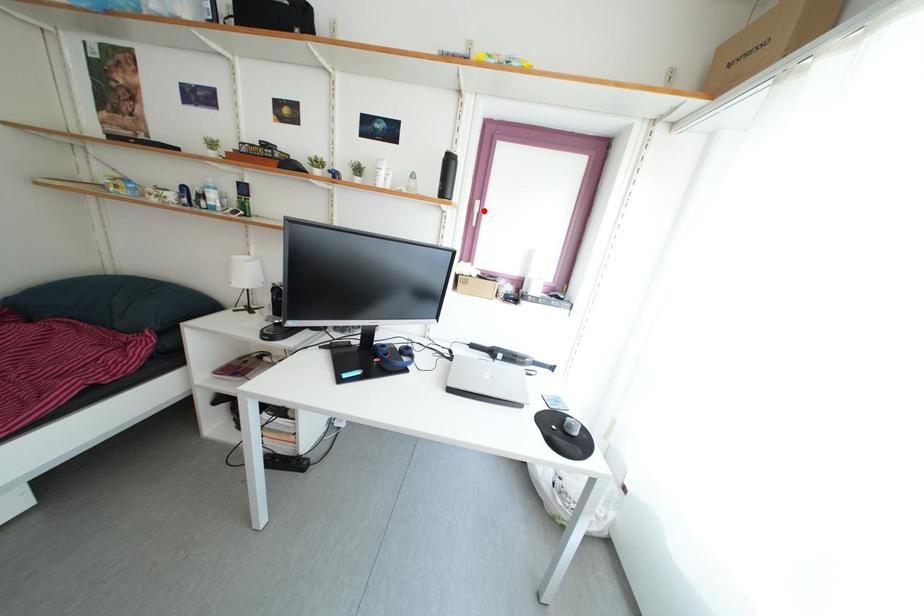
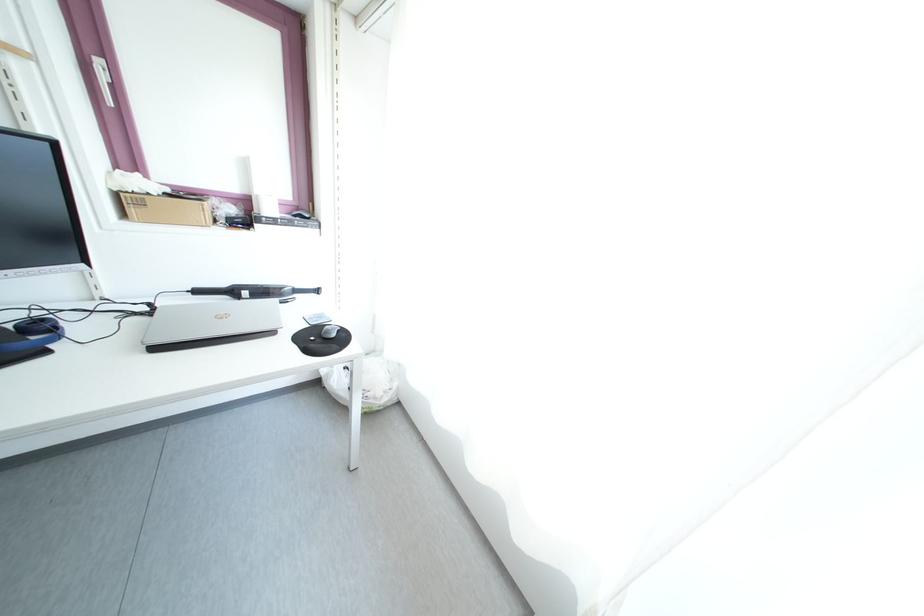
Question: I am providing you with two images of the same scene from different viewpoints. A red point is shown in image1. For the corresponding object point in image2, is it positioned nearer or farther from the camera?

Choices:
 (A) Nearer
 (B) Farther

Answer: (B)